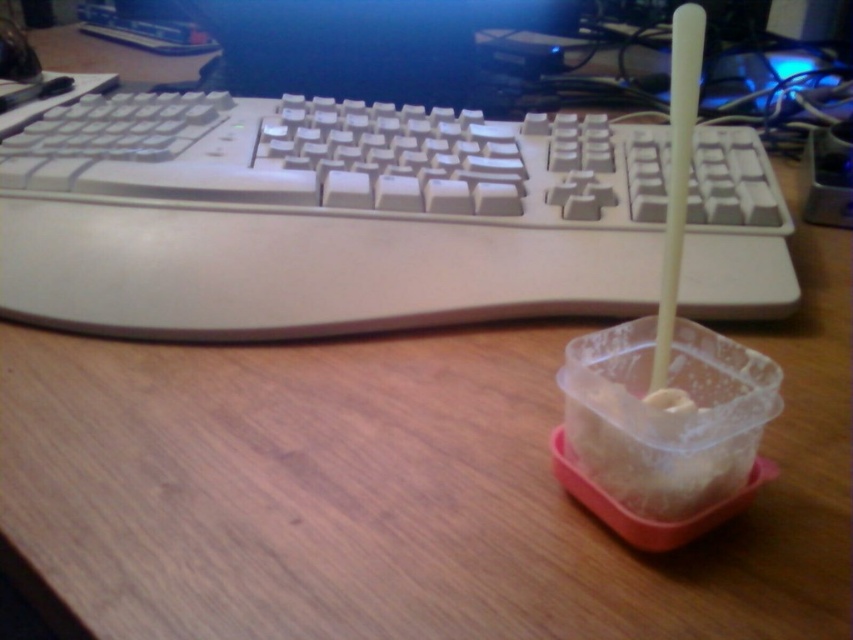
The height and width of the screenshot is (640, 853). What do you see at coordinates (321, 216) in the screenshot?
I see `white plastic keyboard at upper center` at bounding box center [321, 216].

Does point (96, 196) come closer to viewer compared to point (399, 68)?

Yes, it is.

The width and height of the screenshot is (853, 640). What are the coordinates of `white plastic keyboard at upper center` in the screenshot? It's located at (321, 216).

Who is more distant from viewer, (x=451, y=10) or (x=665, y=317)?

Positioned behind is point (x=451, y=10).

Is black plastic monitor at upper center shorter than white plastic straw at right?

No.

Which is behind, point (231, 72) or point (689, 12)?

The point (231, 72) is more distant.

Where is `black plastic monitor at upper center`? The image size is (853, 640). black plastic monitor at upper center is located at coordinates (366, 45).

Does white plastic keyboard at upper center have a smaller size compared to white plastic straw at right?

No, white plastic keyboard at upper center is not smaller than white plastic straw at right.

Does white plastic keyboard at upper center appear under white plastic straw at right?

Correct, white plastic keyboard at upper center is located below white plastic straw at right.

Where is `white plastic keyboard at upper center`? white plastic keyboard at upper center is located at coordinates (321, 216).